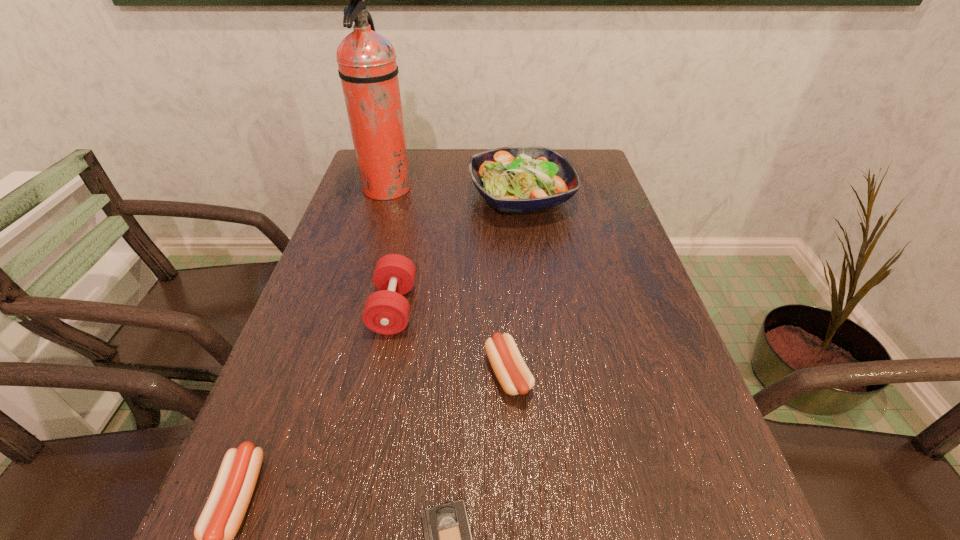
At what (x,y) coordinates should I click in order to perform the action: click on the tallest object. Please return your answer as a coordinate pair (x, y). Looking at the image, I should click on (368, 69).

Where is `salad plate`? salad plate is located at coordinates (517, 179).

At what (x,y) coordinates should I click in order to perform the action: click on dumbbell. Please return your answer as a coordinate pair (x, y). Looking at the image, I should click on (386, 311).

Where is `the fourth nearest object`? the fourth nearest object is located at coordinates (386, 311).

Where is `the fourth farthest object`? This screenshot has width=960, height=540. the fourth farthest object is located at coordinates (514, 376).

You are a GUI agent. You are given a task and a screenshot of the screen. Output one action in this format:
    pyautogui.click(x=<x>, y=<y>)
    Task: Click on the farther sausage
    This screenshot has width=960, height=540.
    Given the screenshot: What is the action you would take?
    pyautogui.click(x=514, y=376)

Where is `vacant space located 0.370m at the nozzle of the tallest object`? vacant space located 0.370m at the nozzle of the tallest object is located at coordinates (536, 190).

Image resolution: width=960 pixels, height=540 pixels. Identify the location of blank area located on the left of the salad plate. (407, 198).

Where is `free spot located on the front of the dumbbell`? This screenshot has height=540, width=960. free spot located on the front of the dumbbell is located at coordinates (372, 418).

Image resolution: width=960 pixels, height=540 pixels. I want to click on free space located 0.100m on the front of the farther sausage, so tap(514, 462).